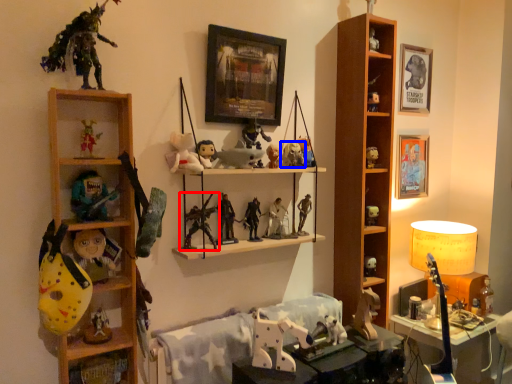
Question: Which object is closer to the camera taking this photo, toy (highlighted by a red box) or toy (highlighted by a blue box)?

Choices:
 (A) toy
 (B) toy

Answer: (A)